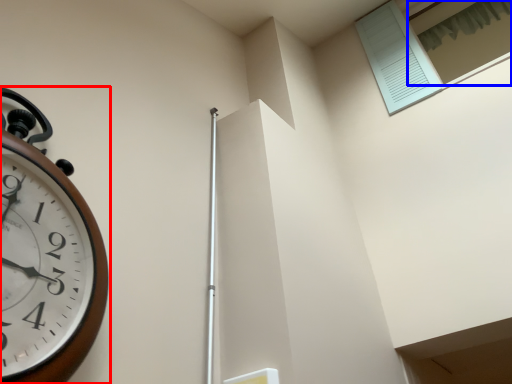
Question: Which point is further to the camera, wall clock (highlighted by a red box) or window (highlighted by a blue box)?

Choices:
 (A) wall clock
 (B) window

Answer: (B)